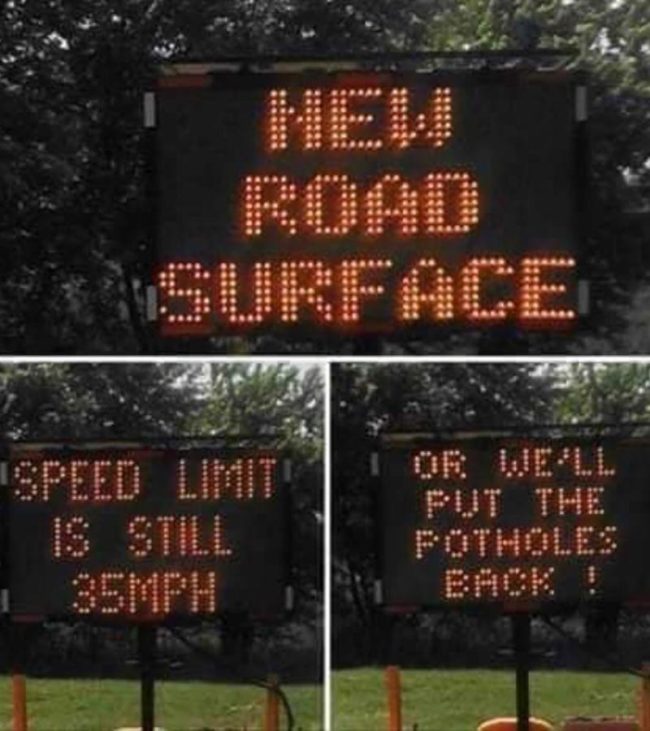
You are a GUI agent. You are given a task and a screenshot of the screen. Output one action in this format:
    pyautogui.click(x=<x>, y=<y>)
    Task: Click on the cable
    The width and height of the screenshot is (650, 731).
    Given the screenshot: What is the action you would take?
    pyautogui.click(x=270, y=689), pyautogui.click(x=561, y=632)